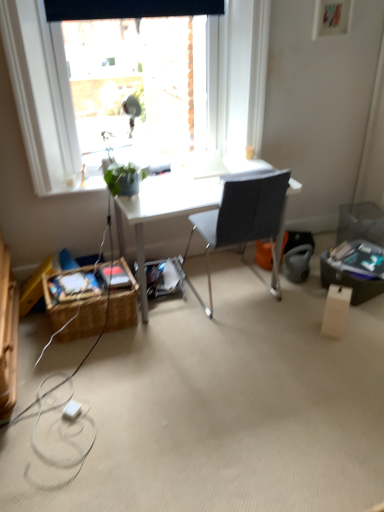
Question: Is transparent glass window at upper center taller than green matte plant at upper left?

Choices:
 (A) yes
 (B) no

Answer: (A)

Question: Is transparent glass window at upper center positioned before green matte plant at upper left?

Choices:
 (A) no
 (B) yes

Answer: (B)

Question: Is transparent glass window at upper center looking in the opposite direction of green matte plant at upper left?

Choices:
 (A) yes
 (B) no

Answer: (B)

Question: Could you tell me if transparent glass window at upper center is turned towards green matte plant at upper left?

Choices:
 (A) yes
 (B) no

Answer: (A)

Question: Does transparent glass window at upper center have a larger size compared to green matte plant at upper left?

Choices:
 (A) no
 (B) yes

Answer: (B)

Question: Can you confirm if transparent glass window at upper center is smaller than green matte plant at upper left?

Choices:
 (A) yes
 (B) no

Answer: (B)

Question: Is green matte plant at upper left located outside gray fabric chair at center?

Choices:
 (A) no
 (B) yes

Answer: (B)

Question: Can you confirm if green matte plant at upper left is wider than gray fabric chair at center?

Choices:
 (A) yes
 (B) no

Answer: (B)

Question: From the image's perspective, is green matte plant at upper left below gray fabric chair at center?

Choices:
 (A) no
 (B) yes

Answer: (A)

Question: From a real-world perspective, is green matte plant at upper left physically above gray fabric chair at center?

Choices:
 (A) no
 (B) yes

Answer: (B)

Question: Is green matte plant at upper left directly adjacent to gray fabric chair at center?

Choices:
 (A) yes
 (B) no

Answer: (B)

Question: Does green matte plant at upper left have a lesser height compared to gray fabric chair at center?

Choices:
 (A) no
 (B) yes

Answer: (B)

Question: From the image's perspective, is white plastic power outlet at lower left under woven brown picnic basket at lower left?

Choices:
 (A) yes
 (B) no

Answer: (A)